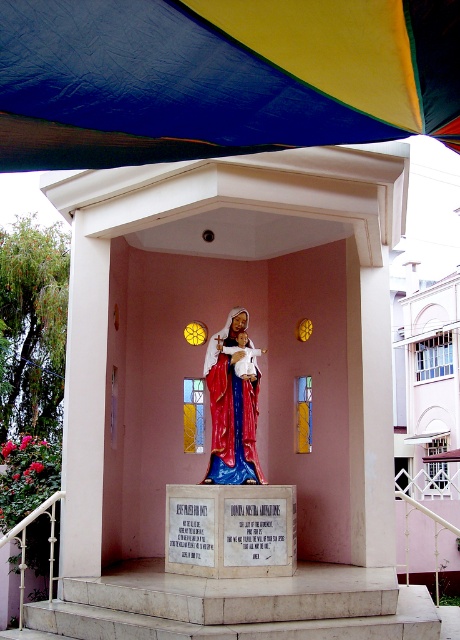
You are standing at the entrance of the shrine and want to approach the statue of the Virgin Mary. The statue is located at the center of the shrine. There are white marble stairs at center leading up to it. However, there is a large textured canvas canopy at upper center that might block your path. Can you walk directly from the entrance to the statue without going around the canopy? Please explain your reasoning based on the distance between the canopy and the stairs.

The textured canvas canopy at upper center is 4.29 meters away from the white marble stairs at center. Since the canopy is positioned above the stairs and not in front of them, you can walk directly up the white marble stairs at center to reach the statue without obstruction from the canopy.

Looking at this image, you are standing in front of the shrine and want to take a photo of both the textured canvas canopy at upper center and the polished wood statue at center. Which object should you adjust your camera angle to focus on first if you want to capture both in the same frame?

The textured canvas canopy at upper center is to the left of the polished wood statue at center, so you should focus on the textured canvas canopy at upper center first to include both in the frame.